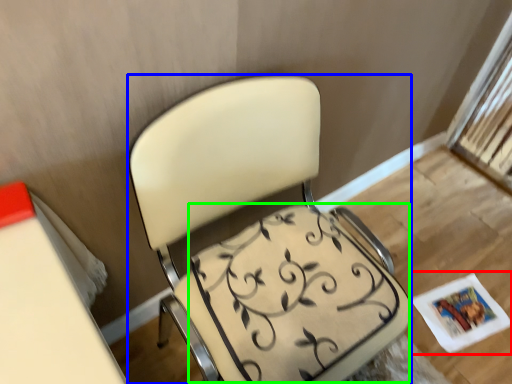
Question: Based on their relative distances, which object is farther from magazine (highlighted by a red box)? Choose from chair (highlighted by a blue box) and swivel chair (highlighted by a green box).

Choices:
 (A) chair
 (B) swivel chair

Answer: (A)